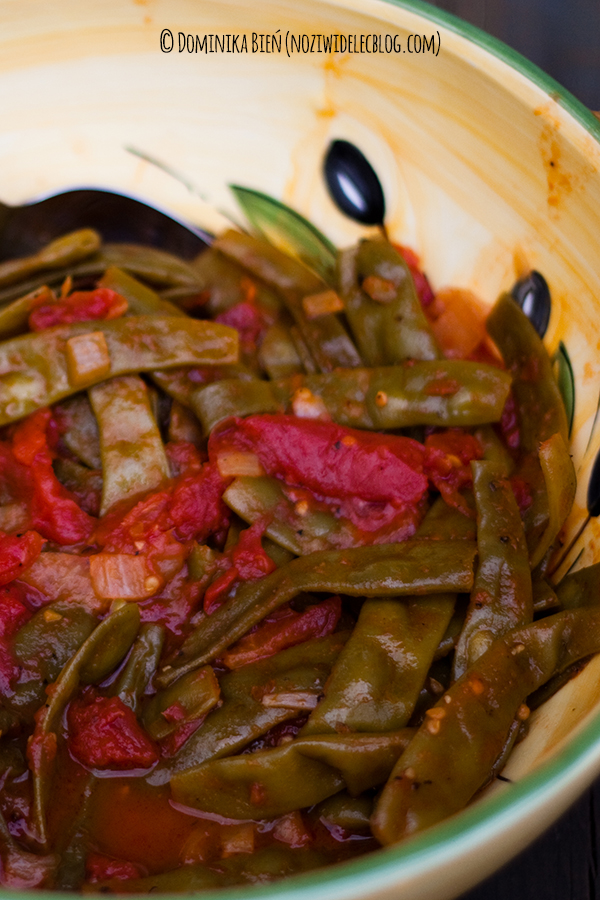
This screenshot has width=600, height=900. I want to click on bowl, so click(453, 131).